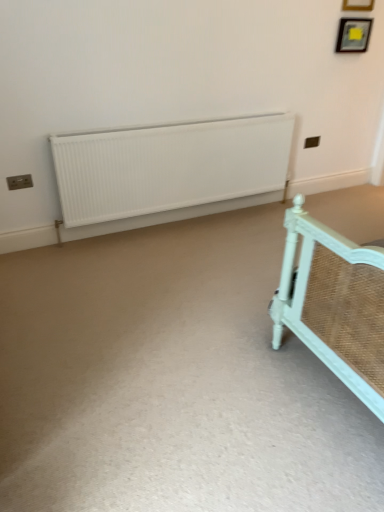
At what (x,y) coordinates should I click in order to perform the action: click on free space in front of white matte radiator at center. Please return your answer as a coordinate pair (x, y). The image size is (384, 512). Looking at the image, I should click on (168, 308).